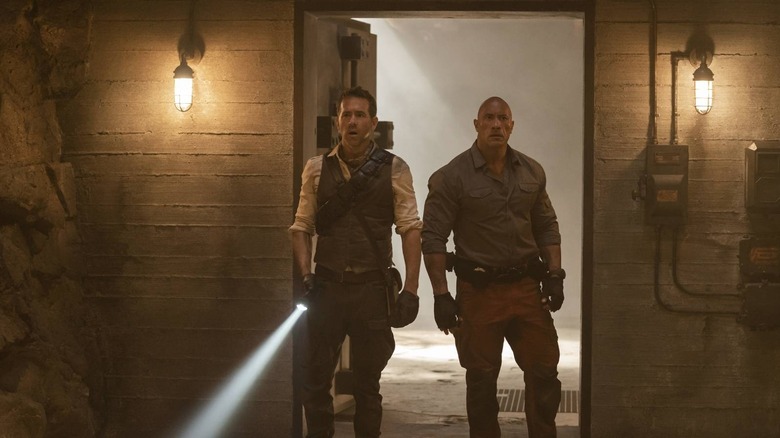
Locate an element on the screen. The image size is (780, 438). white wall is located at coordinates (469, 67).